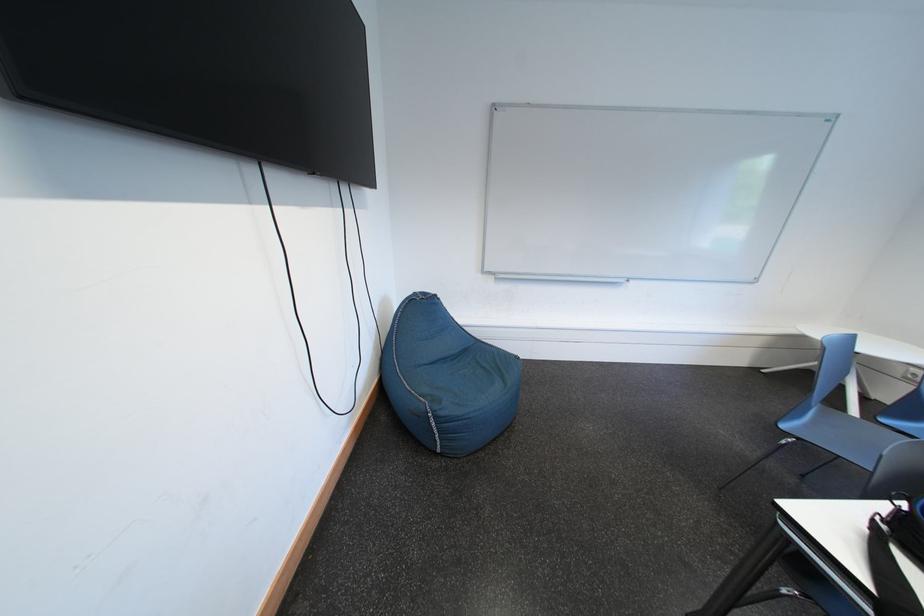
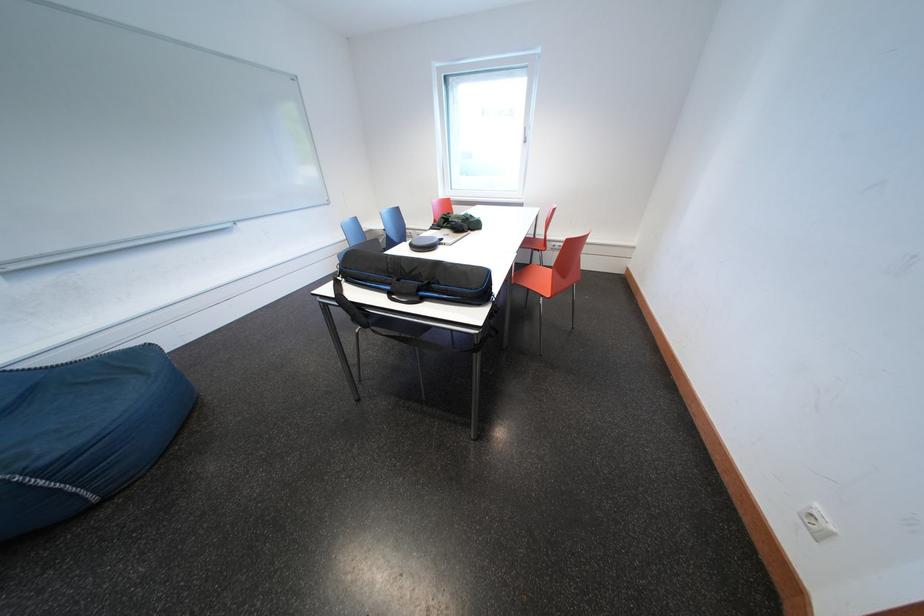
Locate, in the second image, the point that corresponds to point (445, 421) in the first image.

(46, 477)